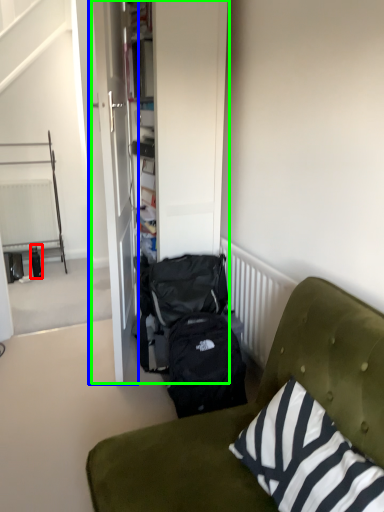
Question: Which object is the farthest from bottle (highlighted by a red box)? Choose among these: door (highlighted by a blue box) or armoire (highlighted by a green box).

Choices:
 (A) door
 (B) armoire

Answer: (B)